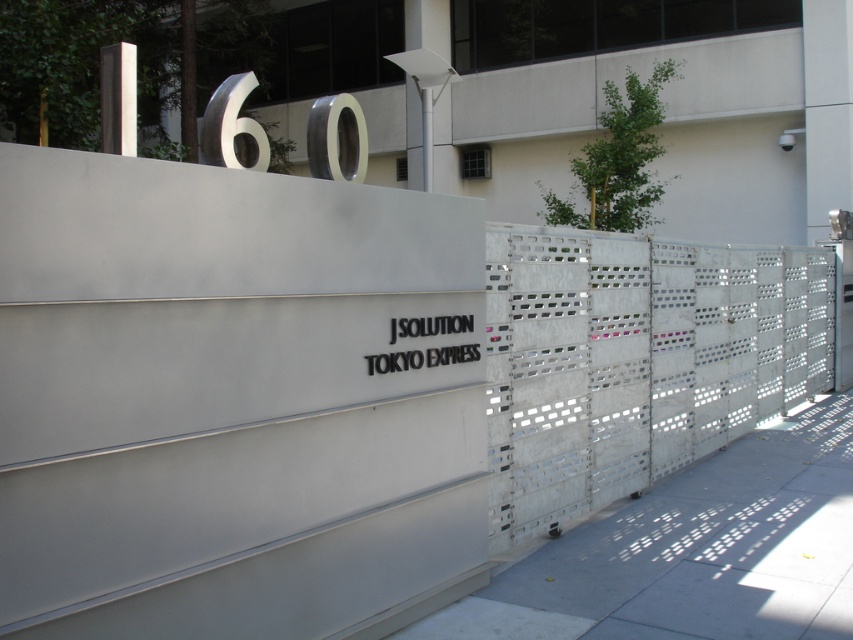
Question: Which of the following is the closest to the observer?

Choices:
 (A) metallic perforated fence at right
 (B) black matte sign at center

Answer: (B)

Question: Observing the image, what is the correct spatial positioning of metallic perforated fence at right in reference to black matte sign at center?

Choices:
 (A) above
 (B) below

Answer: (B)

Question: Is metallic perforated fence at right below black matte sign at center?

Choices:
 (A) no
 (B) yes

Answer: (B)

Question: Is metallic perforated fence at right to the left of black matte sign at center from the viewer's perspective?

Choices:
 (A) yes
 (B) no

Answer: (B)

Question: Which of the following is the farthest from the observer?

Choices:
 (A) metallic perforated fence at right
 (B) black matte sign at center

Answer: (A)